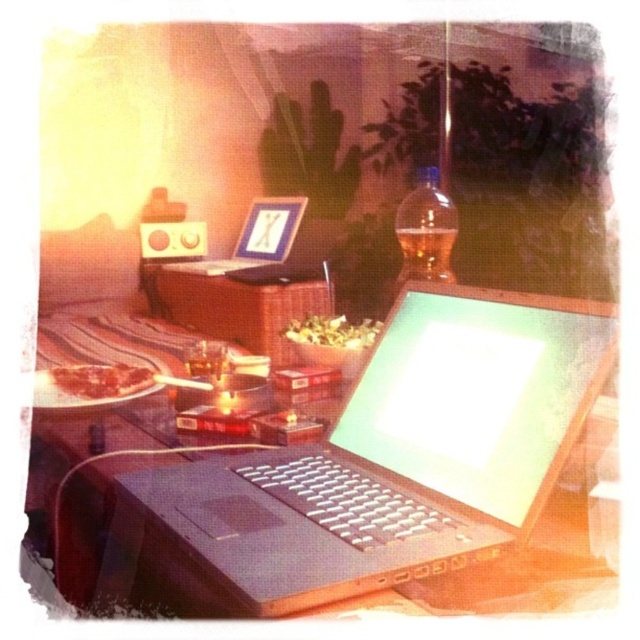
Question: Does satin black laptop at center appear over black matte laptop at center?

Choices:
 (A) yes
 (B) no

Answer: (B)

Question: Is black matte laptop at center positioned in front of matte plastic speaker at upper left?

Choices:
 (A) yes
 (B) no

Answer: (A)

Question: Which point is farther from the camera taking this photo?

Choices:
 (A) (157, 248)
 (B) (408, 451)

Answer: (A)

Question: Which object is positioned closest to the black matte laptop at center?

Choices:
 (A) satin black laptop at center
 (B) matte plastic speaker at upper left

Answer: (B)

Question: Does satin black laptop at center come in front of matte plastic speaker at upper left?

Choices:
 (A) yes
 (B) no

Answer: (A)

Question: Which point appears farthest from the camera in this image?

Choices:
 (A) (141, 221)
 (B) (262, 259)
 (C) (193, 557)

Answer: (A)